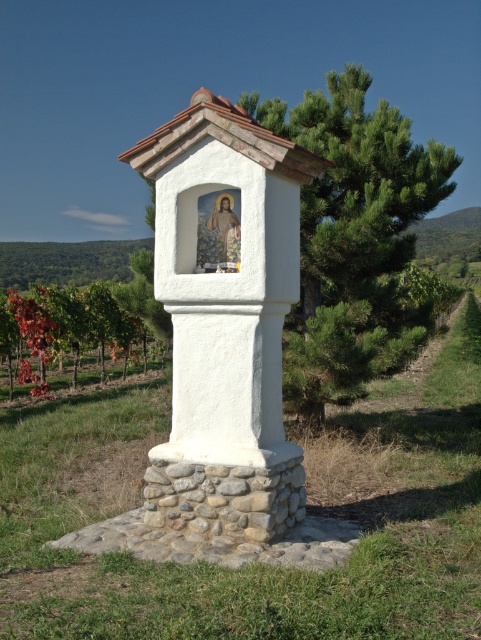
What are the coordinates of the white stucco column at center?

The white stucco column at center is located at coordinates point (225, 321).